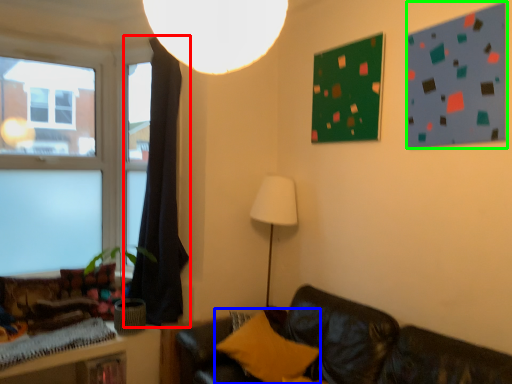
Question: Which is farther away from curtain (highlighted by a red box)? pillow (highlighted by a blue box) or bulletin board (highlighted by a green box)?

Choices:
 (A) pillow
 (B) bulletin board

Answer: (B)